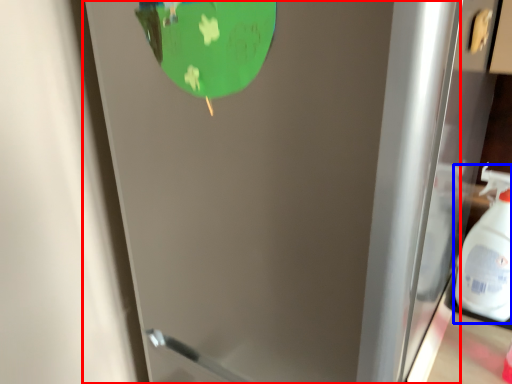
Question: Among these objects, which one is nearest to the camera, door (highlighted by a red box) or cleaning product (highlighted by a blue box)?

Choices:
 (A) door
 (B) cleaning product

Answer: (A)